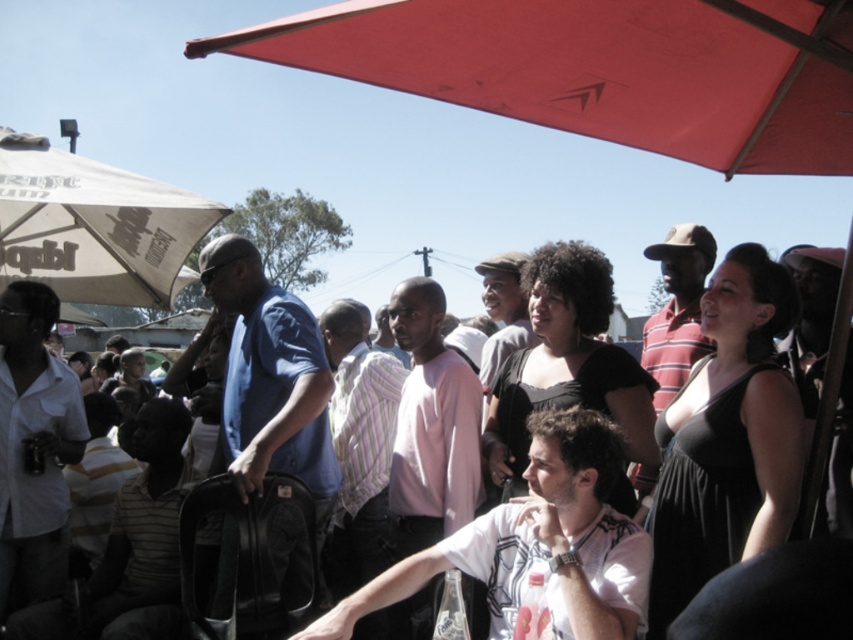
Based on the photo, does pink cotton shirt at center have a lesser width compared to striped cotton shirt at center?

Yes, pink cotton shirt at center is thinner than striped cotton shirt at center.

Between pink cotton shirt at center and striped cotton shirt at center, which one appears on the left side from the viewer's perspective?

pink cotton shirt at center

Is point (426, 445) closer to camera compared to point (677, 278)?

Yes, point (426, 445) is in front of point (677, 278).

What are the coordinates of `pink cotton shirt at center` in the screenshot? It's located at (431, 424).

The image size is (853, 640). Describe the element at coordinates (602, 68) in the screenshot. I see `red fabric umbrella at upper center` at that location.

Does red fabric umbrella at upper center appear on the right side of white fabric umbrella at upper left?

Correct, you'll find red fabric umbrella at upper center to the right of white fabric umbrella at upper left.

Identify the location of red fabric umbrella at upper center. This screenshot has width=853, height=640. (602, 68).

Where is `red fabric umbrella at upper center`? This screenshot has height=640, width=853. red fabric umbrella at upper center is located at coordinates (602, 68).

Is point (575, 609) more distant than point (103, 288)?

No, it is not.

You are a GUI agent. You are given a task and a screenshot of the screen. Output one action in this format:
    pyautogui.click(x=<x>, y=<y>)
    Task: Click on the white cotton t-shirt at center
    Image resolution: width=853 pixels, height=640 pixels.
    Given the screenshot: What is the action you would take?
    pyautogui.click(x=537, y=541)